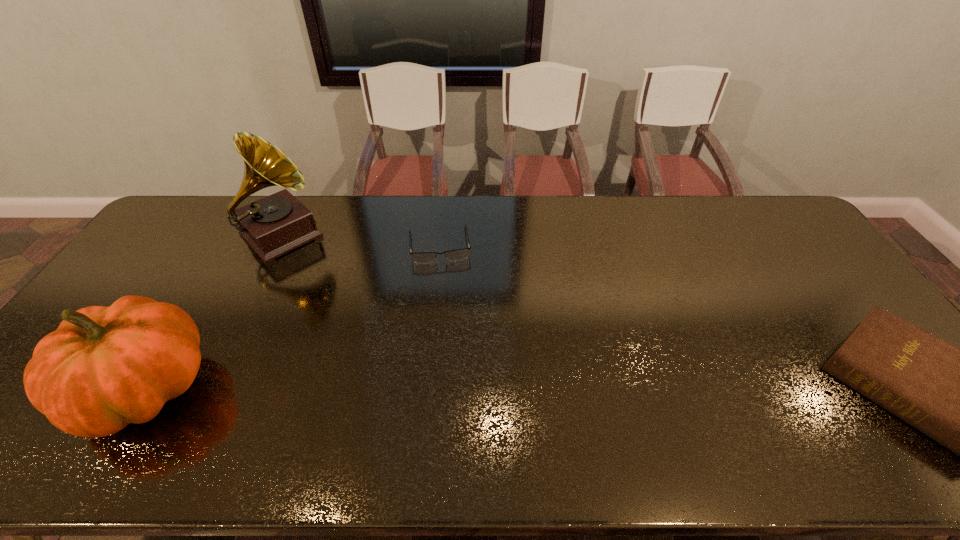
I want to click on free space located from the horn of the tallest object, so click(346, 300).

This screenshot has width=960, height=540. I want to click on spectacles that is at the far edge, so (x=453, y=255).

Locate an element on the screen. The width and height of the screenshot is (960, 540). phonograph record at the far edge is located at coordinates (279, 223).

Where is `object that is at the near edge`? This screenshot has height=540, width=960. object that is at the near edge is located at coordinates (104, 367).

Find the location of a particular element. object that is at the left edge is located at coordinates coord(104,367).

Locate an element on the screen. The height and width of the screenshot is (540, 960). object that is at the near left corner is located at coordinates (104, 367).

Where is `free space at the far edge`? free space at the far edge is located at coordinates (647, 200).

Locate an element on the screen. The height and width of the screenshot is (540, 960). vacant region at the near edge is located at coordinates (466, 399).

Locate an element on the screen. vacant space at the left edge is located at coordinates (186, 255).

You are a GUI agent. You are given a task and a screenshot of the screen. Output one action in this format:
    pyautogui.click(x=<x>, y=<y>)
    Task: Click on the vacant space at the right edge of the desktop
    The image size is (960, 540).
    Given the screenshot: What is the action you would take?
    pyautogui.click(x=798, y=284)